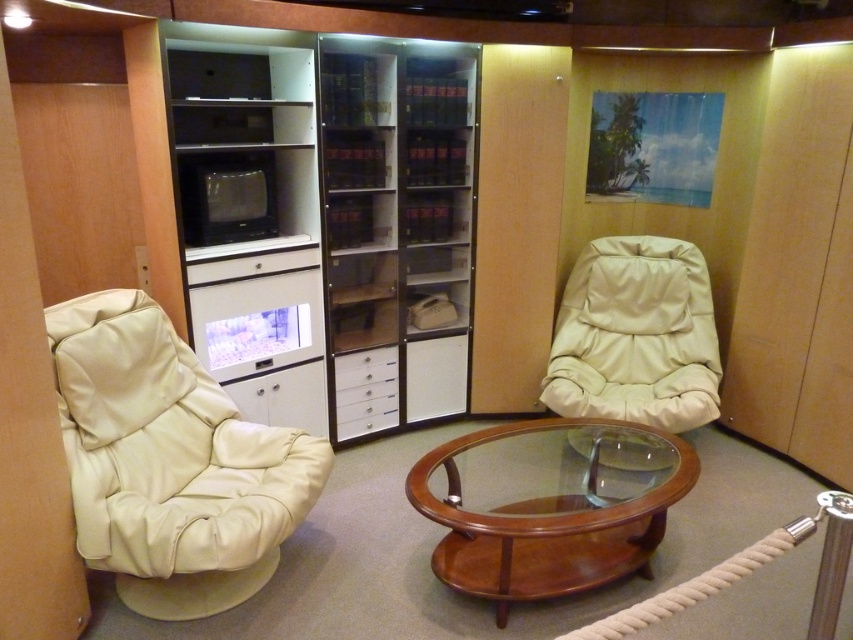
Between white leather swivel chair at left and beige leather swivel chair at center, which one is positioned higher?

beige leather swivel chair at center is above.

Can you confirm if white leather swivel chair at left is smaller than beige leather swivel chair at center?

Incorrect, white leather swivel chair at left is not smaller in size than beige leather swivel chair at center.

Based on the photo, measure the distance between point (148, 596) and camera.

Point (148, 596) and camera are 2.48 meters apart from each other.

You are a GUI agent. You are given a task and a screenshot of the screen. Output one action in this format:
    pyautogui.click(x=<x>, y=<y>)
    Task: Click on the white leather swivel chair at left
    This screenshot has height=640, width=853.
    Given the screenshot: What is the action you would take?
    pyautogui.click(x=170, y=461)

Is mahogany glass coffee table at center thinner than white glossy drawer at center?

In fact, mahogany glass coffee table at center might be wider than white glossy drawer at center.

Does point (654, 481) lie behind point (351, 364)?

No, it is not.

Between point (599, 422) and point (381, 364), which one is positioned behind?

The point (381, 364) is more distant.

Where is `mahogany glass coffee table at center`? The width and height of the screenshot is (853, 640). mahogany glass coffee table at center is located at coordinates (549, 512).

Can you confirm if transparent plastic bookshelf at center is positioned to the left of beige leather swivel chair at center?

Correct, you'll find transparent plastic bookshelf at center to the left of beige leather swivel chair at center.

Does transparent plastic bookshelf at center have a greater height compared to beige leather swivel chair at center?

Indeed, transparent plastic bookshelf at center has a greater height compared to beige leather swivel chair at center.

Who is more distant from viewer, (x=332, y=234) or (x=666, y=371)?

The point (x=666, y=371) is more distant.

You are a GUI agent. You are given a task and a screenshot of the screen. Output one action in this format:
    pyautogui.click(x=<x>, y=<y>)
    Task: Click on the transparent plastic bookshelf at center
    This screenshot has width=853, height=640.
    Given the screenshot: What is the action you would take?
    coord(398,227)